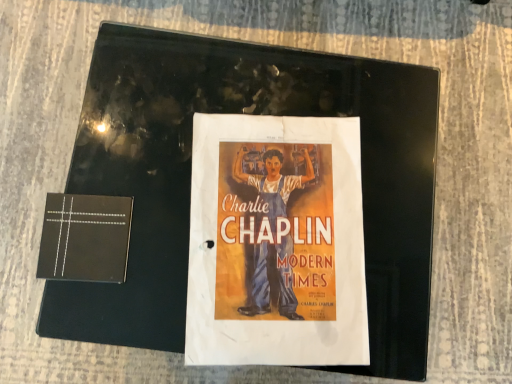
Locate an element on the screen. The height and width of the screenshot is (384, 512). vacant space to the right of black matte paper at left is located at coordinates (247, 240).